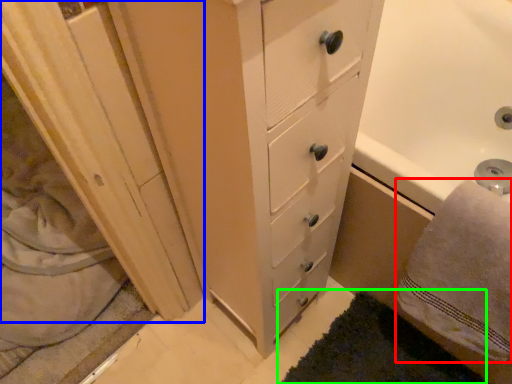
Question: Which is nearer to the bath towel (highlighted by a red box)? screen door (highlighted by a blue box) or bath mat (highlighted by a green box).

Choices:
 (A) screen door
 (B) bath mat

Answer: (B)